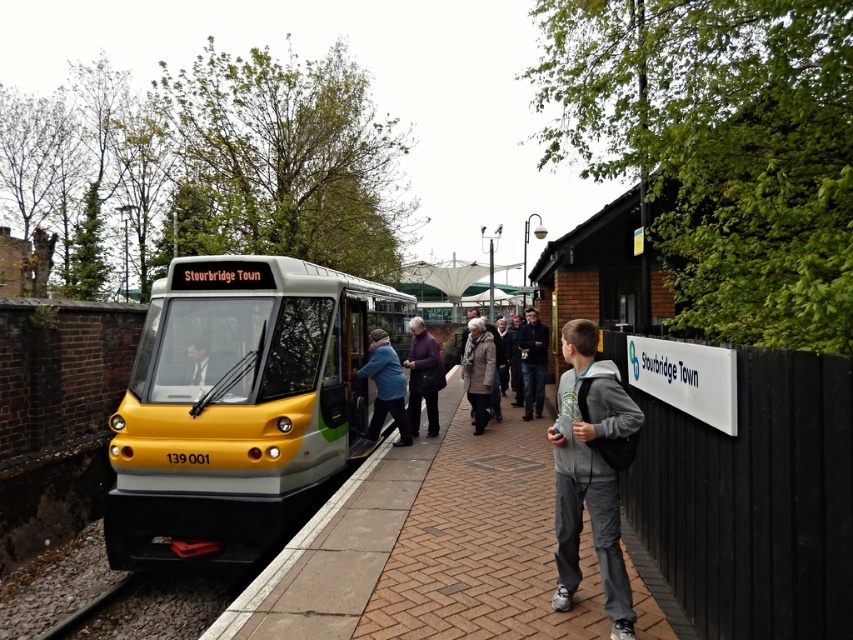
Is yellow metallic train at center positioned in front of gravel train track at lower left?

That is False.

Does yellow metallic train at center appear on the right side of gravel train track at lower left?

Indeed, yellow metallic train at center is positioned on the right side of gravel train track at lower left.

Locate an element on the screen. The image size is (853, 640). yellow metallic train at center is located at coordinates (238, 406).

Where is `yellow metallic train at center`? The height and width of the screenshot is (640, 853). yellow metallic train at center is located at coordinates (238, 406).

Is the position of brick platform at center less distant than that of purple woolen sweater at center?

Yes.

Who is shorter, brick platform at center or purple woolen sweater at center?

With less height is brick platform at center.

Find the location of a particular element. The image size is (853, 640). brick platform at center is located at coordinates (427, 548).

Is gray fleece jacket at center to the left of blue fabric jacket at center from the viewer's perspective?

Incorrect, gray fleece jacket at center is not on the left side of blue fabric jacket at center.

Who is more distant from viewer, (566, 552) or (370, 365)?

Point (370, 365)

Identify the location of gray fleece jacket at center. (590, 474).